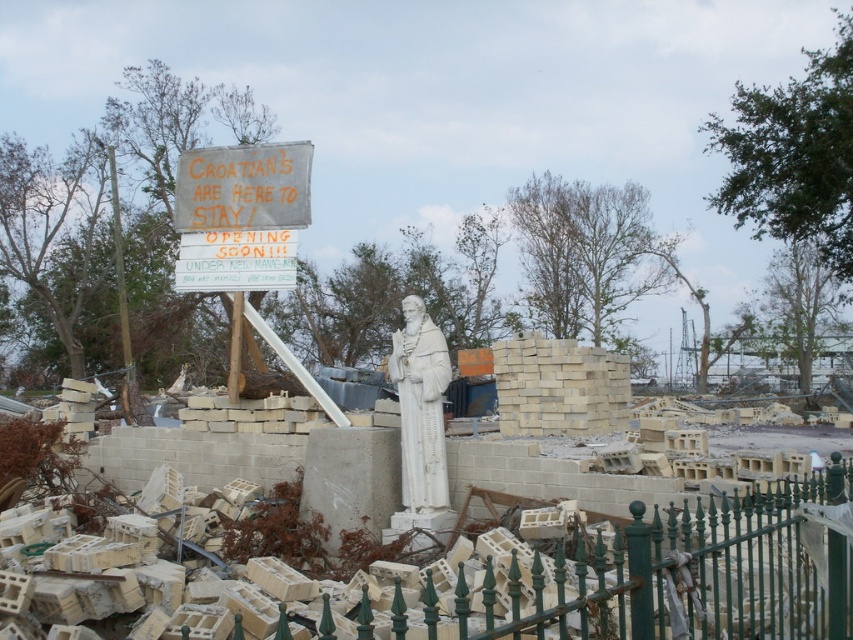
Question: Which object is the closest to the white marble statue at center?

Choices:
 (A) white concrete statue at center
 (B) green wrought iron fence at center

Answer: (A)

Question: Which of the following is the closest to the observer?

Choices:
 (A) green wrought iron fence at center
 (B) wooden sign at upper center
 (C) white concrete statue at center

Answer: (C)

Question: Is white concrete statue at center wider than white marble statue at center?

Choices:
 (A) yes
 (B) no

Answer: (A)

Question: Which of the following is the farthest from the observer?

Choices:
 (A) green wrought iron fence at center
 (B) wooden sign at upper center

Answer: (B)

Question: Can you confirm if wooden sign at upper center is positioned above white marble statue at center?

Choices:
 (A) yes
 (B) no

Answer: (A)

Question: Can you confirm if white concrete statue at center is bigger than white marble statue at center?

Choices:
 (A) yes
 (B) no

Answer: (A)